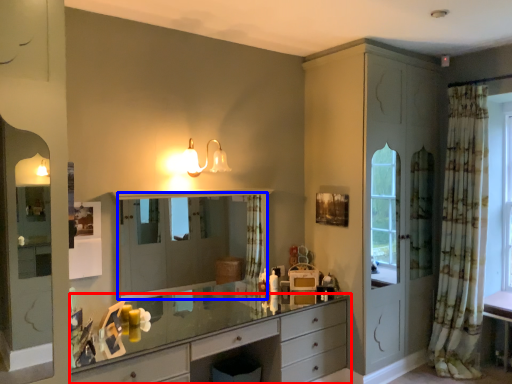
Question: Which object appears farthest to the camera in this image, chest of drawers (highlighted by a red box) or mirror (highlighted by a blue box)?

Choices:
 (A) chest of drawers
 (B) mirror

Answer: (B)